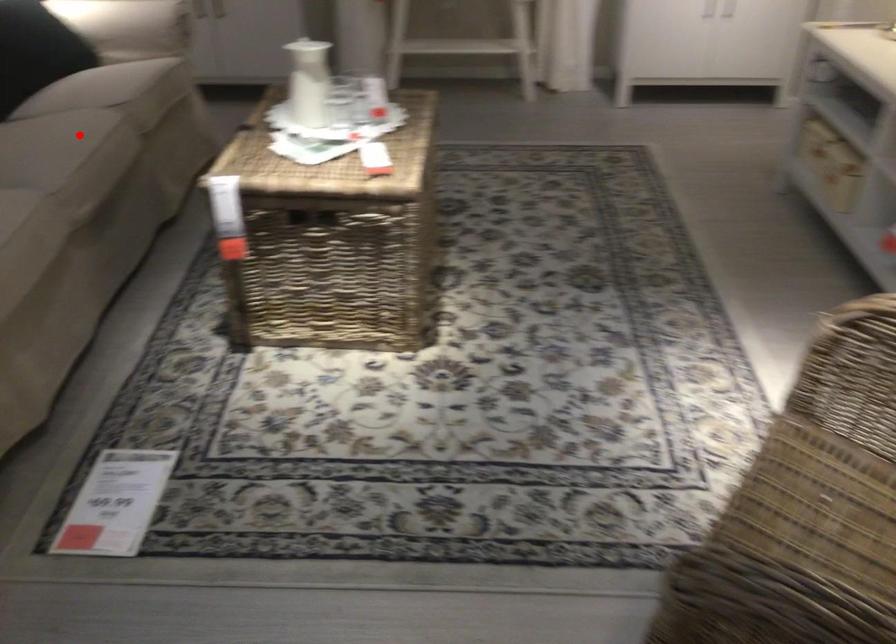
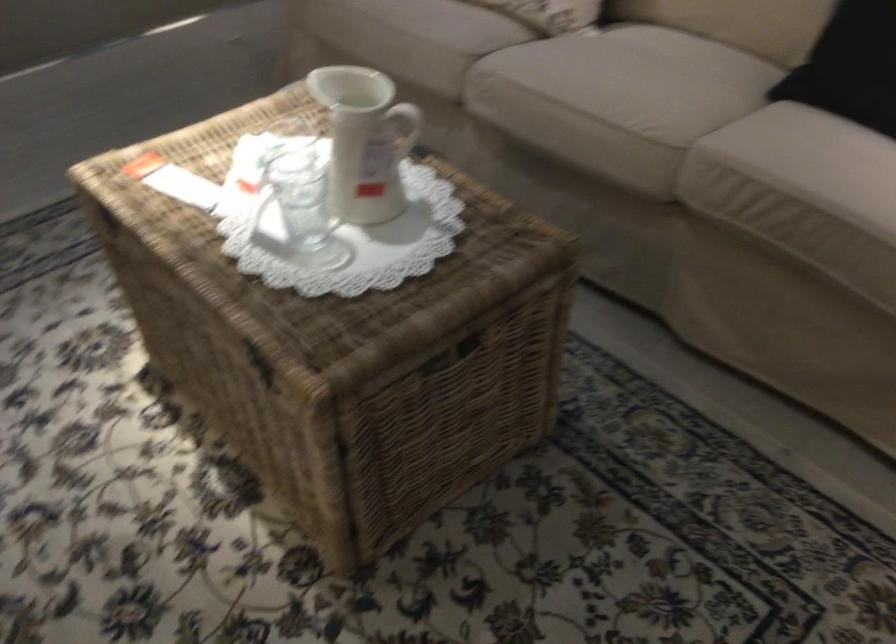
Locate, in the second image, the point that corresponds to the highlighted location in the first image.

(617, 93)